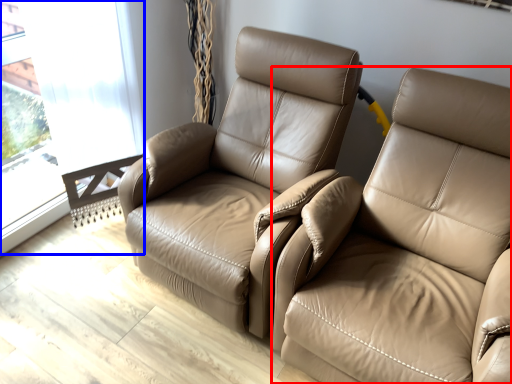
Question: Which object is further to the camera taking this photo, studio couch (highlighted by a red box) or window (highlighted by a blue box)?

Choices:
 (A) studio couch
 (B) window

Answer: (B)